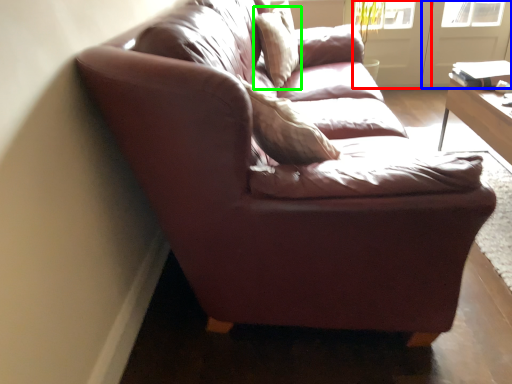
Question: Considering the real-world distances, which object is farthest from screen door (highlighted by a red box)? screen door (highlighted by a blue box) or pillow (highlighted by a green box)?

Choices:
 (A) screen door
 (B) pillow

Answer: (B)